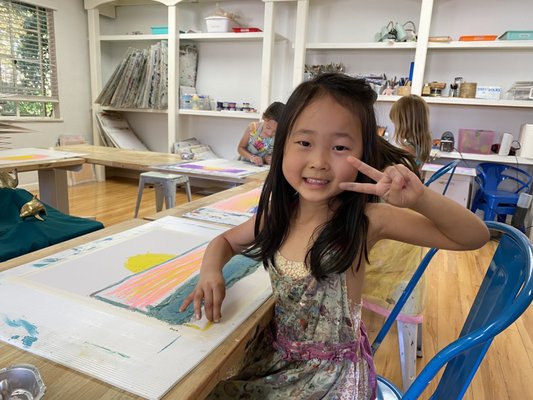
Identify the location of floor. Image resolution: width=533 pixels, height=400 pixels. (505, 373), (111, 200).